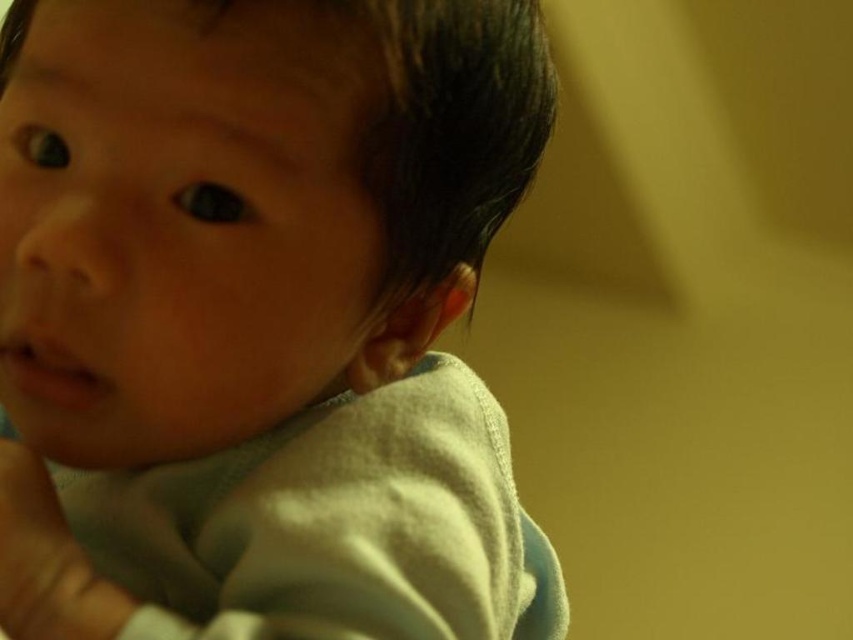
Is smooth skin baby at center positioned in front of white soft hand at lower left?

Yes, smooth skin baby at center is closer to the viewer.

Between smooth skin baby at center and white soft hand at lower left, which one is positioned higher?

smooth skin baby at center is higher up.

Is point (74, 266) behind point (3, 627)?

No, it is in front of (3, 627).

The image size is (853, 640). In order to click on smooth skin baby at center in this screenshot , I will do `click(260, 320)`.